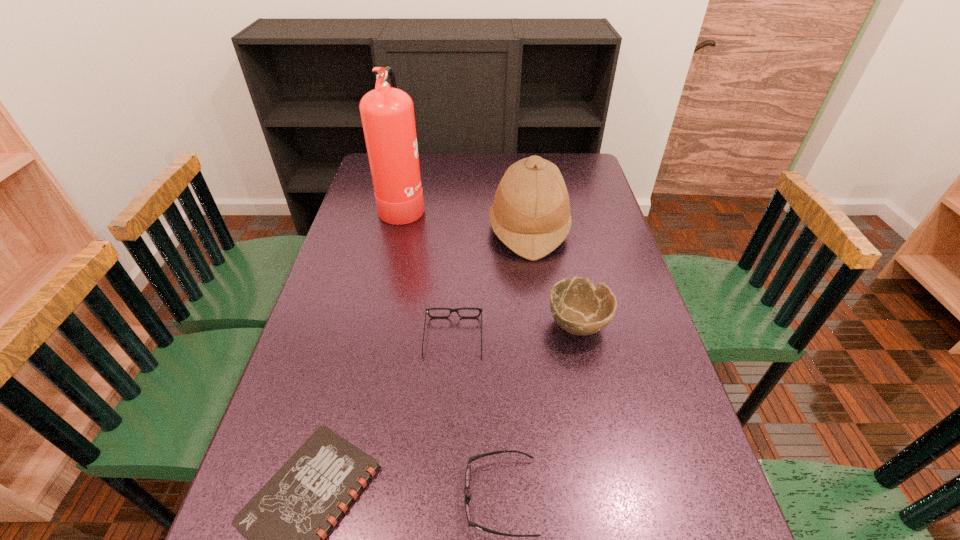
This screenshot has height=540, width=960. What are the coordinates of `fire extinguisher` in the screenshot? It's located at pyautogui.click(x=387, y=113).

Locate an element on the screen. This screenshot has width=960, height=540. hat is located at coordinates (530, 214).

Find the location of a particular element. the fourth shortest object is located at coordinates tap(578, 307).

At what (x,y) coordinates should I click in order to perform the action: click on spectacles. Please return your answer as a coordinate pair (x, y). Looking at the image, I should click on (427, 310).

The width and height of the screenshot is (960, 540). What are the coordinates of `vacant area situated towards the nozzle of the tallest object` in the screenshot? It's located at (490, 205).

In order to click on vacant region located 0.240m on the front-facing side of the hat in this screenshot , I will do pyautogui.click(x=415, y=228).

Locate an element on the screen. The image size is (960, 540). vacant space located on the front-facing side of the hat is located at coordinates (470, 228).

The width and height of the screenshot is (960, 540). In order to click on free space located on the front-facing side of the hat in this screenshot , I will do (x=455, y=228).

You are a GUI agent. You are given a task and a screenshot of the screen. Output one action in this format:
    pyautogui.click(x=<x>, y=<y>)
    Task: Click on the free space located 0.080m on the right of the fourth shortest object
    This screenshot has width=960, height=540.
    Given the screenshot: What is the action you would take?
    [x=641, y=323]

This screenshot has width=960, height=540. Identify the location of vacant space situated 0.200m on the front-facing side of the spectacles. (457, 266).